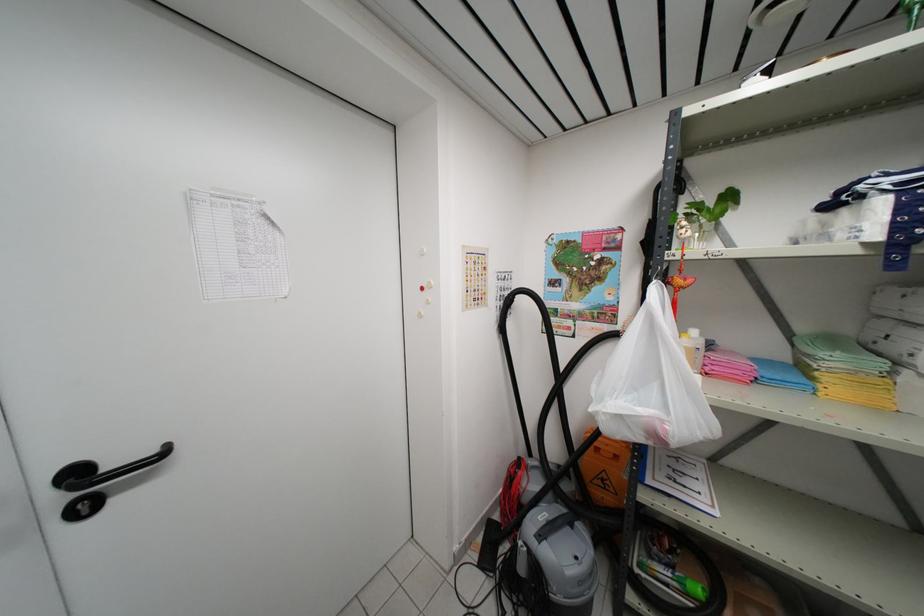
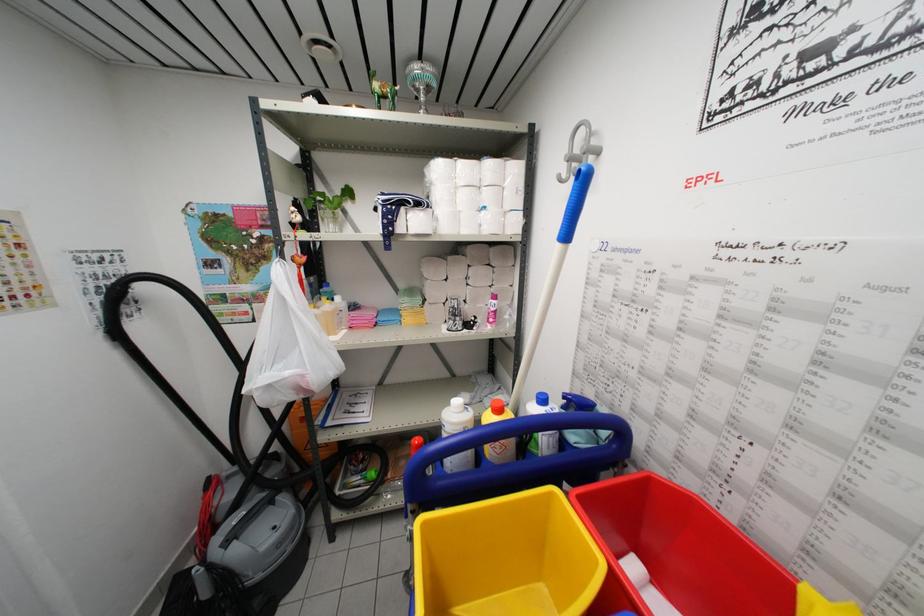
Question: How did the camera likely rotate?

Choices:
 (A) Left
 (B) Right
 (C) Up
 (D) Down

Answer: (B)